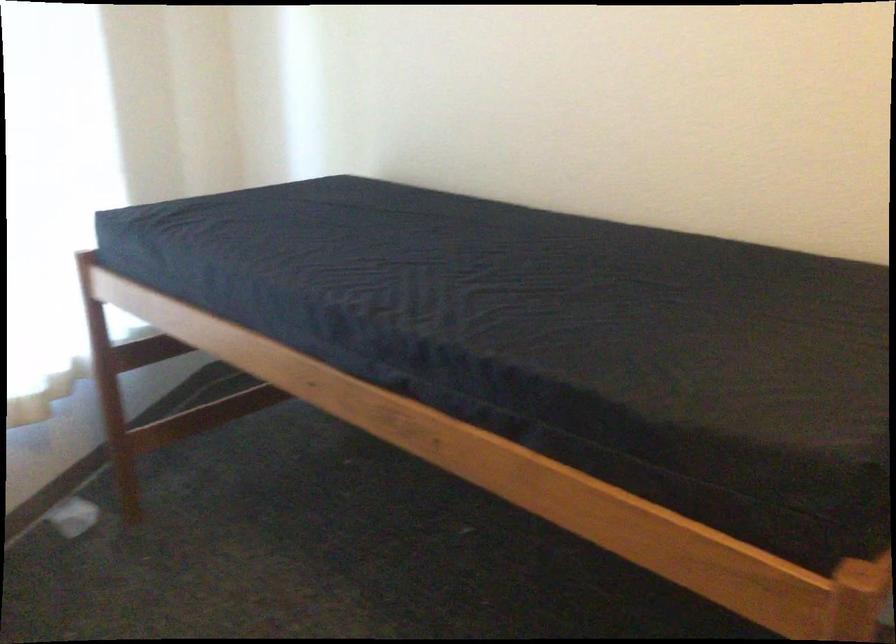
Where would you sit the bed sitting surface? Please return your answer as a coordinate pair (x, y).

(460, 297)